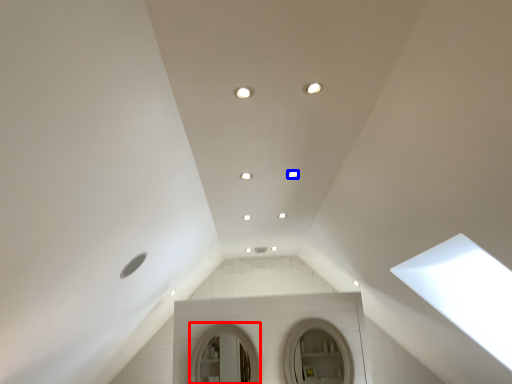
Question: Which of the following is the closest to the observer, mirror (highlighted by a red box) or lighting (highlighted by a blue box)?

Choices:
 (A) mirror
 (B) lighting

Answer: (B)